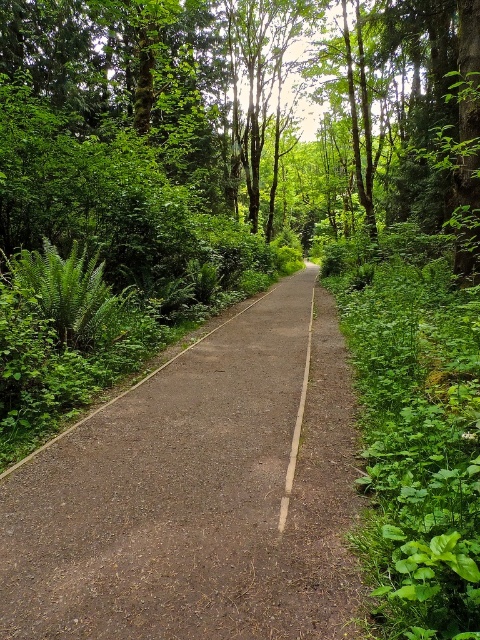
You are a cyclist riding along the forest path and need to stay within the road markings. The path has the dull brown asphalt at center and the white painted line at center. Which of these two is wider?

The white painted line at center is wider than the dull brown asphalt at center.

You are standing at the point labeled as point [126,582] on the forest path. If you want to walk towards the viewer, which direction should you go?

Since the point [126,582] is 4.87 feet away from the viewer, you should walk towards the viewer by moving in the direction opposite to where the path leads away from them.